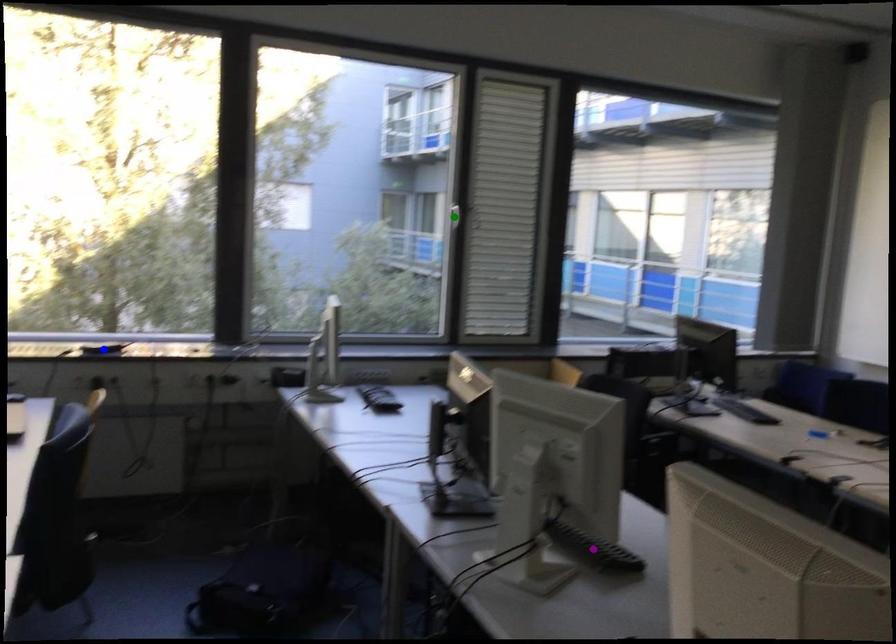
Order these from nearest to farthest:
- blue point
- green point
- purple point

purple point
blue point
green point